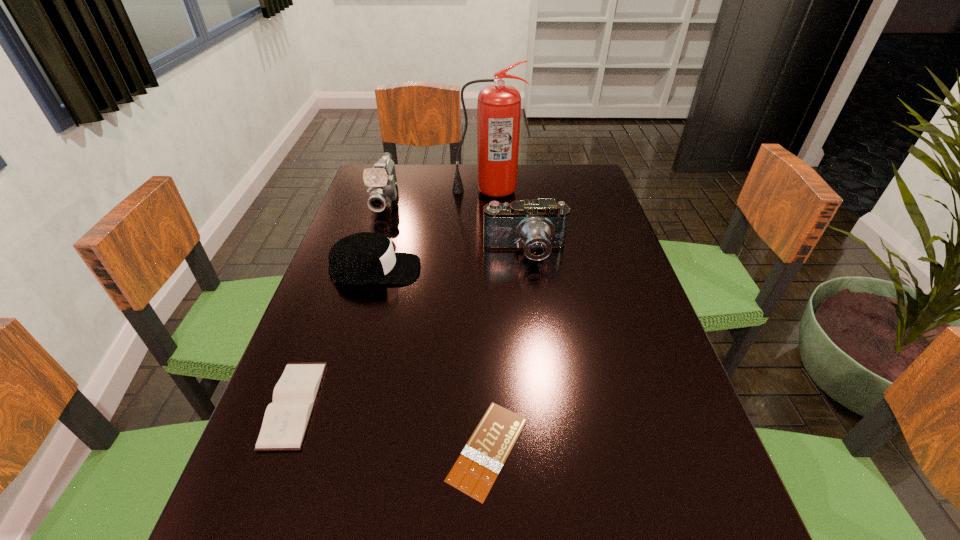
Identify the location of free space that is in between the chocolate bar and the farther camcorder. Image resolution: width=960 pixels, height=540 pixels. (437, 323).

This screenshot has width=960, height=540. I want to click on free point between the tallest object and the left camcorder, so click(x=437, y=194).

What are the coordinates of `free space between the fifth tallest object and the farther camcorder` in the screenshot? It's located at (340, 301).

Locate an element on the screen. This screenshot has height=540, width=960. the third closest object to the shortest object is located at coordinates (539, 226).

Select which object appears as the fourth closest to the chocolate bar. Please provide its 2D coordinates. Your answer should be formatted as a tuple, i.e. [(x, y)], where the tuple contains the x and y coordinates of a point satisfying the conditions above.

[(382, 180)]

At what (x,y) coordinates should I click in order to perform the action: click on blank area in the image that satisfies the following two spatial constraints: 1. on the front-facing side of the shortest object; 2. on the left side of the farther camcorder. Please return your answer as a coordinate pair (x, y). Image resolution: width=960 pixels, height=540 pixels. Looking at the image, I should click on (309, 449).